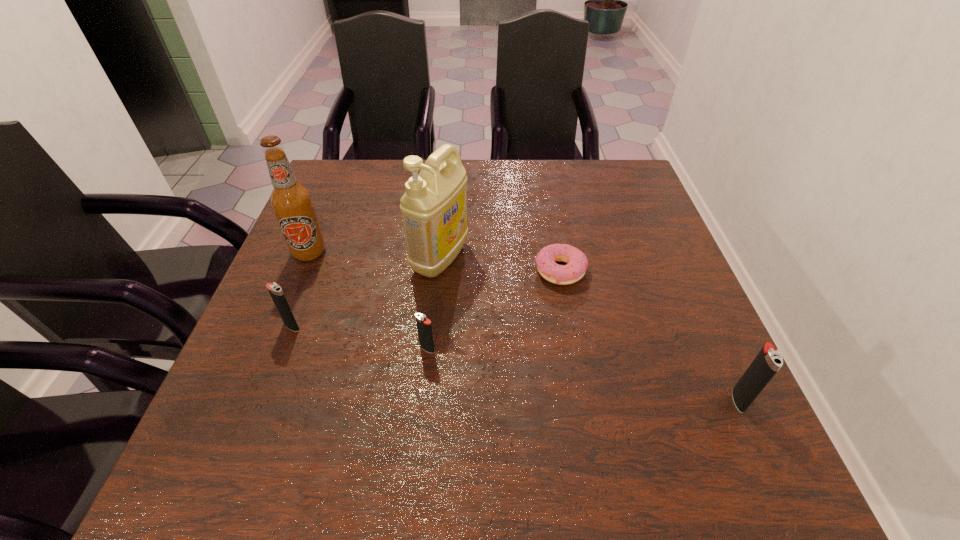
Identify the location of vacant area situated on the back of the farthest igniter. (333, 219).

Find the location of a particular element. The image size is (960, 540). free spot located on the right of the second farthest igniter is located at coordinates (607, 349).

Where is `free region located on the back of the fourth shortest object`? The image size is (960, 540). free region located on the back of the fourth shortest object is located at coordinates (677, 265).

Where is `free location located on the right of the detergent`? The height and width of the screenshot is (540, 960). free location located on the right of the detergent is located at coordinates (597, 258).

Locate an element on the screen. Image resolution: width=960 pixels, height=540 pixels. blank space located 0.060m on the right of the fifth object from left to right is located at coordinates (612, 271).

At what (x,y) coordinates should I click in order to perform the action: click on vacant space located on the front label of the beer bottle. Please return your answer as a coordinate pair (x, y). Image resolution: width=960 pixels, height=540 pixels. Looking at the image, I should click on [x=276, y=332].

Where is `object at the near edge`? The height and width of the screenshot is (540, 960). object at the near edge is located at coordinates (766, 364).

The width and height of the screenshot is (960, 540). I want to click on igniter at the left edge, so (x=278, y=297).

Locate an element on the screen. Image resolution: width=960 pixels, height=540 pixels. beer bottle positioned at the left edge is located at coordinates (291, 201).

Locate an element on the screen. object that is at the right edge is located at coordinates (766, 364).